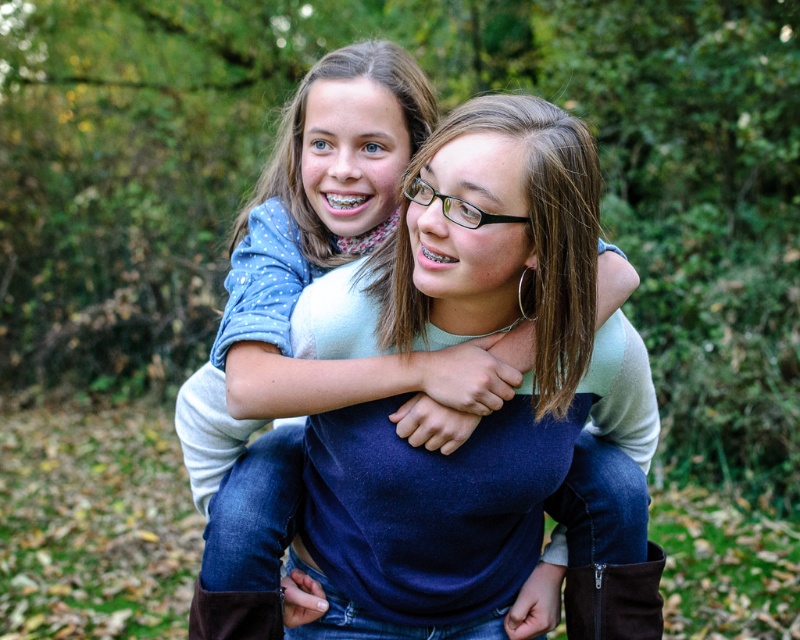
Question: Which object appears closest to the camera in this image?

Choices:
 (A) brown suede boot at lower right
 (B) matte blue sweater at center

Answer: (B)

Question: Can you confirm if matte blue sweater at center is positioned above brown suede boot at lower right?

Choices:
 (A) yes
 (B) no

Answer: (A)

Question: Does matte blue sweater at center have a lesser width compared to brown suede boot at lower right?

Choices:
 (A) yes
 (B) no

Answer: (B)

Question: Which point is closer to the camera?

Choices:
 (A) matte blue sweater at center
 (B) brown suede boot at lower right

Answer: (A)

Question: In this image, where is matte blue sweater at center located relative to brown suede boot at lower right?

Choices:
 (A) above
 (B) below

Answer: (A)

Question: Among these points, which one is farthest from the camera?

Choices:
 (A) (345, 193)
 (B) (644, 618)

Answer: (B)